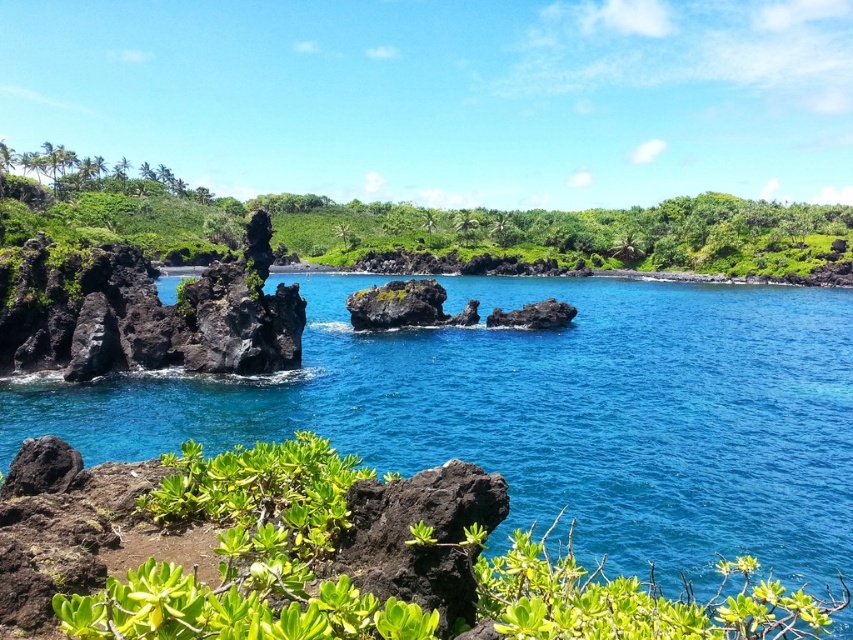
Question: Is blue glossy water at center behind dark brown rock at center?

Choices:
 (A) yes
 (B) no

Answer: (B)

Question: In this image, where is blue glossy water at center located relative to black volcanic rock at lower left?

Choices:
 (A) right
 (B) left

Answer: (A)

Question: Considering the real-world distances, which object is closest to the black volcanic rock at lower left?

Choices:
 (A) dark brown rock at center
 (B) green leafy shrubs at left

Answer: (A)

Question: Which point appears farthest from the camera in this image?

Choices:
 (A) (316, 205)
 (B) (35, 444)

Answer: (A)

Question: Is blue glossy water at center bigger than dark brown rock at center?

Choices:
 (A) no
 (B) yes

Answer: (B)

Question: Which point appears closest to the camera in this image?

Choices:
 (A) (508, 317)
 (B) (59, 486)
 (C) (206, 404)

Answer: (B)